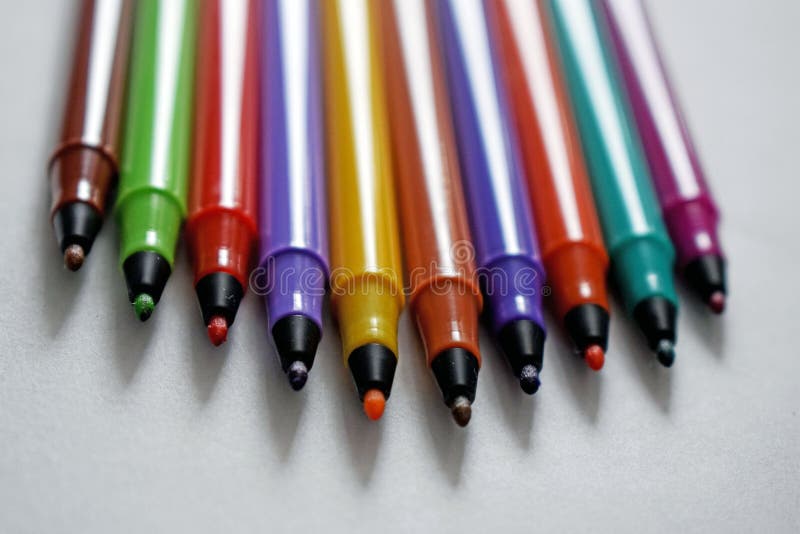
At what (x,y) coordinates should I click in order to perform the action: click on markers. Please return your answer as a coordinate pair (x, y). Looking at the image, I should click on (90, 117), (153, 154), (224, 168), (288, 187), (358, 208), (433, 215), (501, 207), (561, 212), (634, 208), (680, 182).